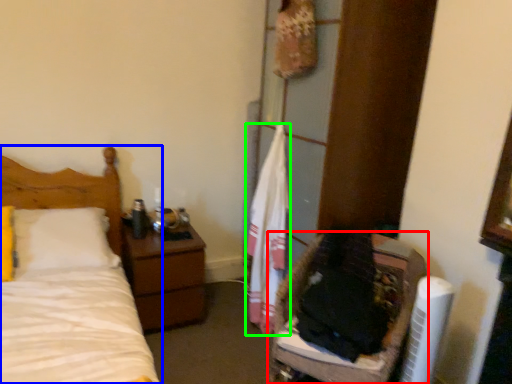
Question: Based on their relative distances, which object is farther from furniture (highlighted by a red box)? Choose from bed (highlighted by a blue box) and clothe (highlighted by a green box).

Choices:
 (A) bed
 (B) clothe

Answer: (A)